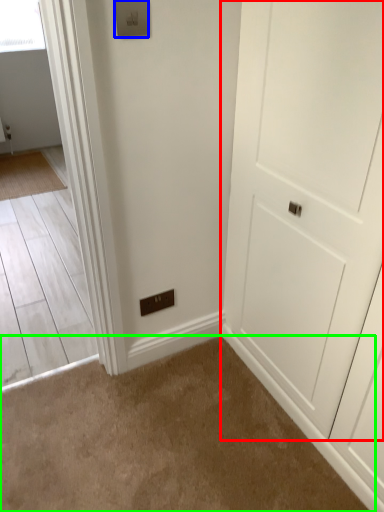
Question: Which object is the closest to the door (highlighted by a red box)? Choose among these: light switch (highlighted by a blue box) or plain (highlighted by a green box).

Choices:
 (A) light switch
 (B) plain

Answer: (B)